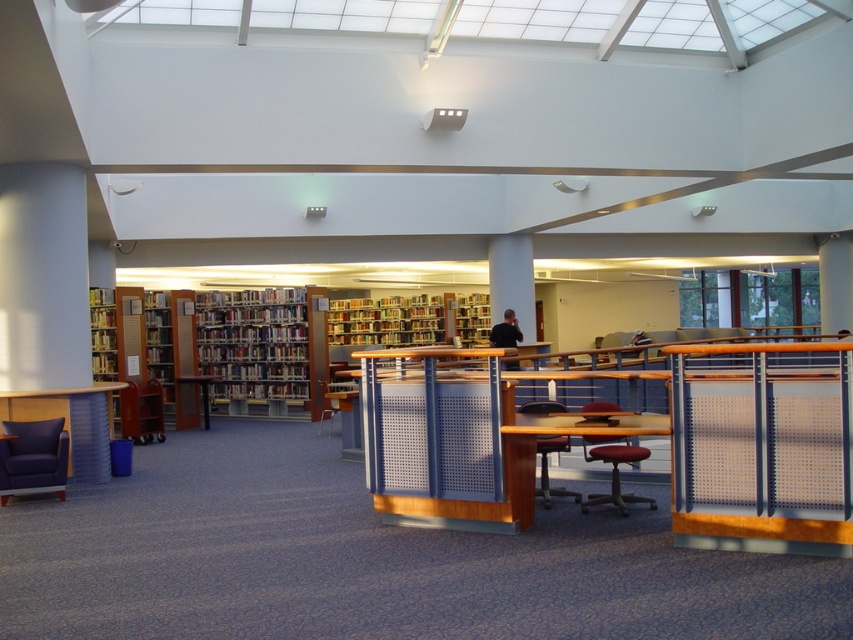
Question: Is dark blue fabric swivel chair at lower left in front of red leather office chair at center?

Choices:
 (A) yes
 (B) no

Answer: (B)

Question: Among these objects, which one is farthest from the camera?

Choices:
 (A) dark blue fabric swivel chair at lower left
 (B) matte black chair at center

Answer: (A)

Question: Does dark blue fabric swivel chair at lower left appear on the left side of red leather office chair at center?

Choices:
 (A) yes
 (B) no

Answer: (A)

Question: Which point is farther to the camera?

Choices:
 (A) (544, 452)
 (B) (45, 442)

Answer: (B)

Question: Is red leather office chair at center to the right of matte black chair at center from the viewer's perspective?

Choices:
 (A) yes
 (B) no

Answer: (A)

Question: Which of these objects is positioned farthest from the dark blue fabric swivel chair at lower left?

Choices:
 (A) red leather office chair at center
 (B) matte black chair at center
 (C) wooden bookshelf at center

Answer: (C)